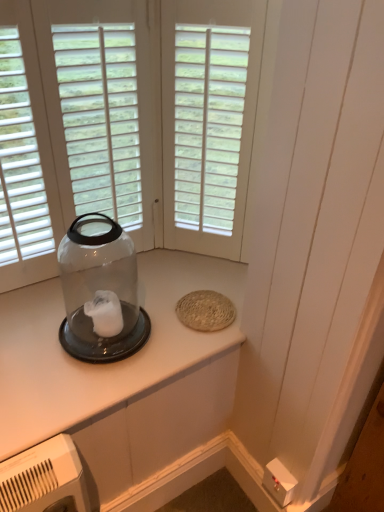
Identify the location of free location to the left of transparent glass jar at left. (34, 327).